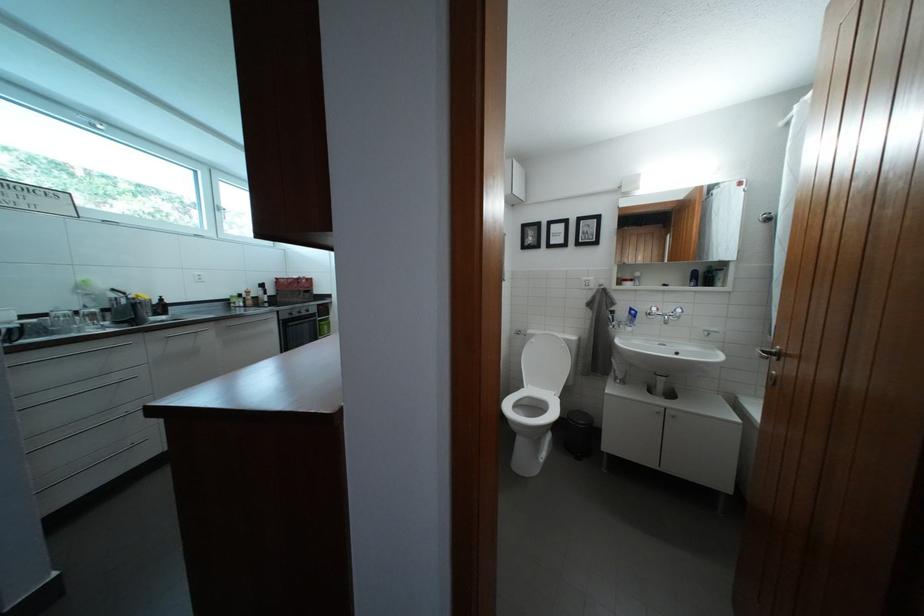
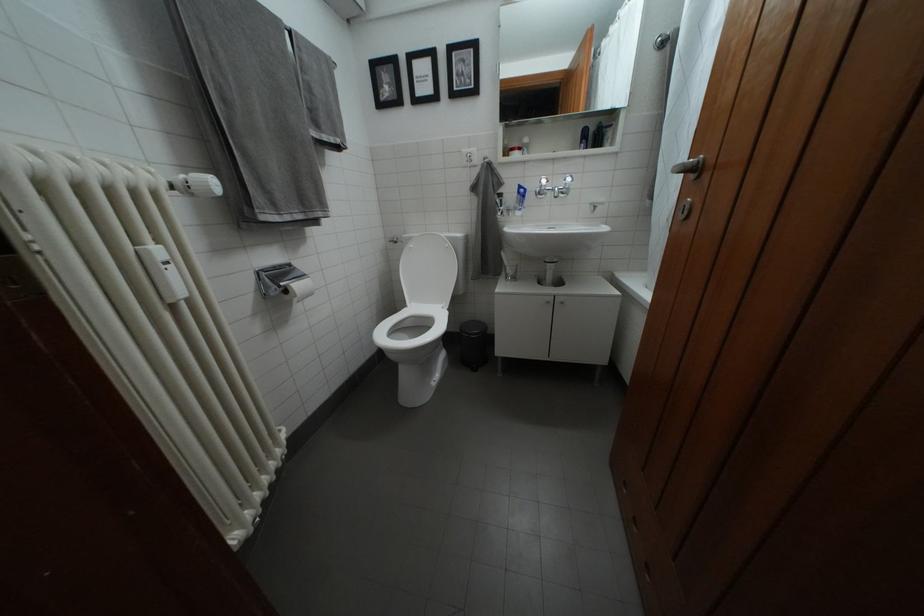
The images are taken continuously from a first-person perspective. In which direction are you moving?

The cameraman walked toward right, forward.